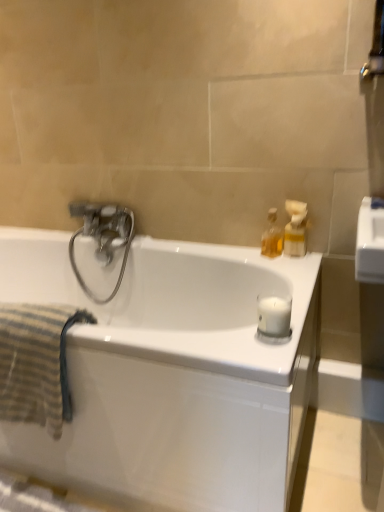
Image resolution: width=384 pixels, height=512 pixels. Find the location of `free space in front of white matte candle at right`. free space in front of white matte candle at right is located at coordinates 271,351.